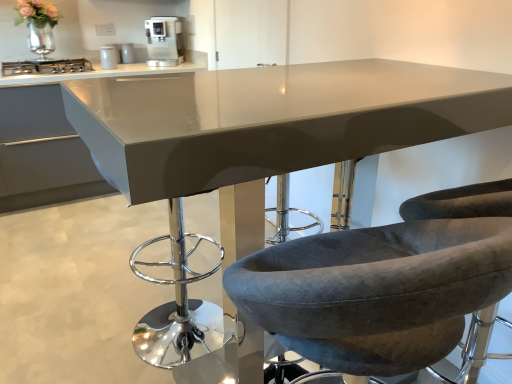
Question: Considering the positions of stainless steel stove at left and satin silver coffee machine at upper center in the image, is stainless steel stove at left taller or shorter than satin silver coffee machine at upper center?

Choices:
 (A) short
 (B) tall

Answer: (A)

Question: From the image's perspective, is stainless steel stove at left above or below satin silver coffee machine at upper center?

Choices:
 (A) above
 (B) below

Answer: (B)

Question: Estimate the real-world distances between objects in this image. Which object is closer to the satin white countertop at upper left?

Choices:
 (A) velvet grey chair at center, which is the 1th chair from right to left
 (B) velvet grey chair at center, arranged as the 1th chair when viewed from the left
 (C) stainless steel stove at left
 (D) metallic silver canister at upper center, positioned as the first appliance in top-to-bottom order
 (E) satin silver coffee machine at upper center

Answer: (C)

Question: Estimate the real-world distances between objects in this image. Which object is farther from the metallic silver canister at upper center, which appears as the 1th appliance when viewed from the back?

Choices:
 (A) velvet grey chair at center, the second chair positioned from the right
 (B) velvet grey chair at center, acting as the second chair starting from the left
 (C) metallic silver coffee machine at upper center, which ranks as the 1th appliance in front-to-back order
 (D) satin white countertop at upper left
 (E) satin silver coffee machine at upper center

Answer: (A)